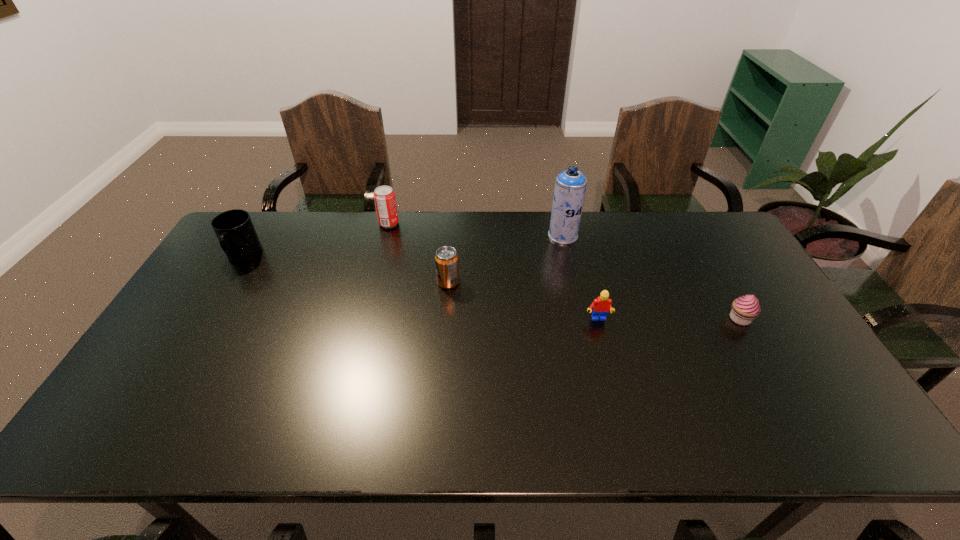
Image resolution: width=960 pixels, height=540 pixels. Identify the location of aerosol can. (570, 186).

Locate an element on the screen. This screenshot has width=960, height=540. the left soda can is located at coordinates (384, 197).

You are a GUI agent. You are given a task and a screenshot of the screen. Output one action in this format:
    pyautogui.click(x=<x>, y=<y>)
    Task: Click on the fifth object from right to left
    
    Given the screenshot: What is the action you would take?
    tap(384, 197)

Where is `mug`? The height and width of the screenshot is (540, 960). mug is located at coordinates (x=234, y=229).

Locate an element on the screen. The width and height of the screenshot is (960, 540). the fourth object from right to left is located at coordinates (446, 259).

You are a GUI agent. You are given a task and a screenshot of the screen. Output one action in this format:
    pyautogui.click(x=<x>, y=<y>)
    Task: Click on the third nearest object
    The width and height of the screenshot is (960, 540).
    Given the screenshot: What is the action you would take?
    pyautogui.click(x=446, y=259)

Where is `Lego`? The height and width of the screenshot is (540, 960). Lego is located at coordinates (602, 305).

Locate an element on the screen. cupcake is located at coordinates (744, 309).

At what (x,y) coordinates should I click in order to perform the action: click on free spot located on the front of the tallest object. Please return your answer as a coordinate pair (x, y). The image size is (960, 540). Looking at the image, I should click on pyautogui.click(x=579, y=305).

Locate an element on the screen. Image resolution: width=960 pixels, height=540 pixels. vacant space located 0.330m on the left of the left soda can is located at coordinates (286, 224).